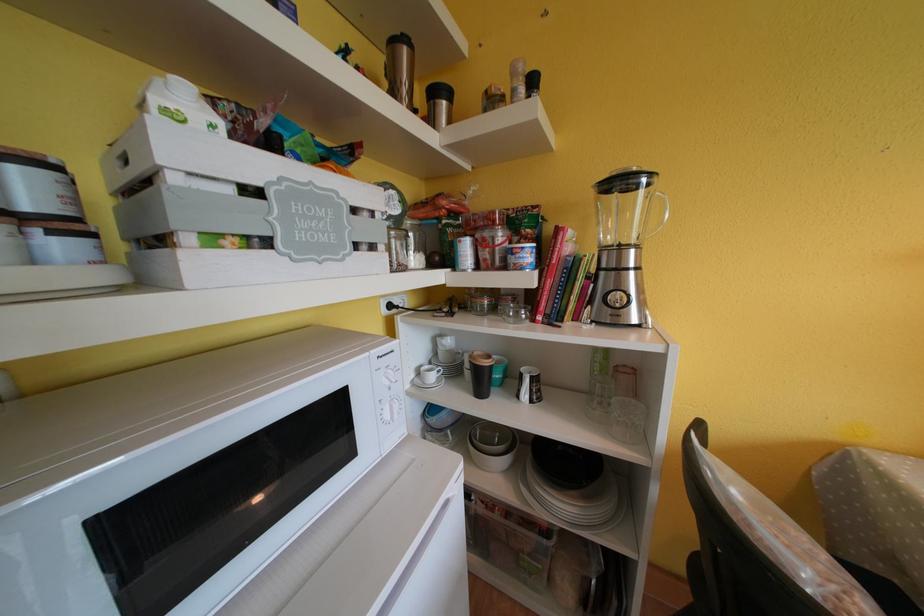
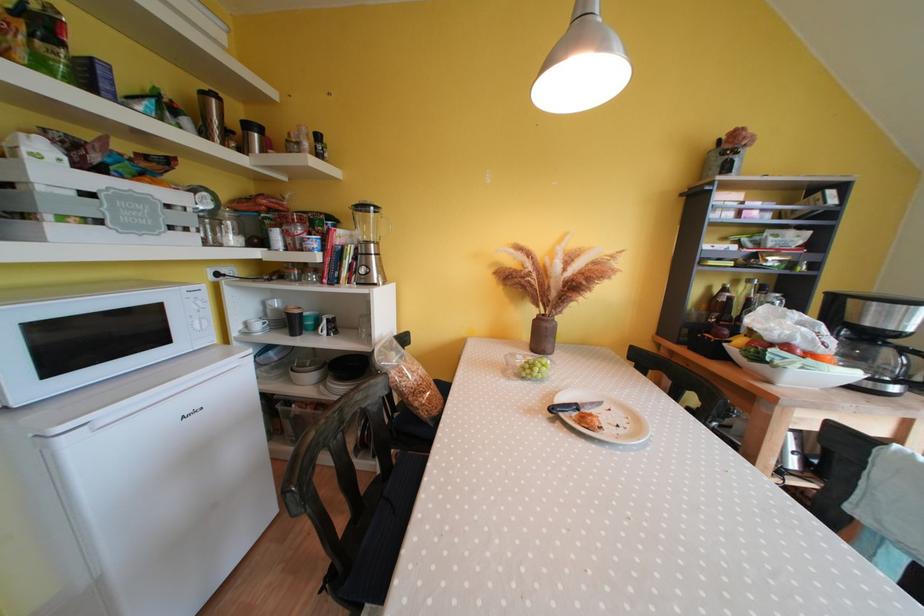
The point at (402, 410) is marked in the first image. Where is the corresponding point in the second image?

(210, 325)